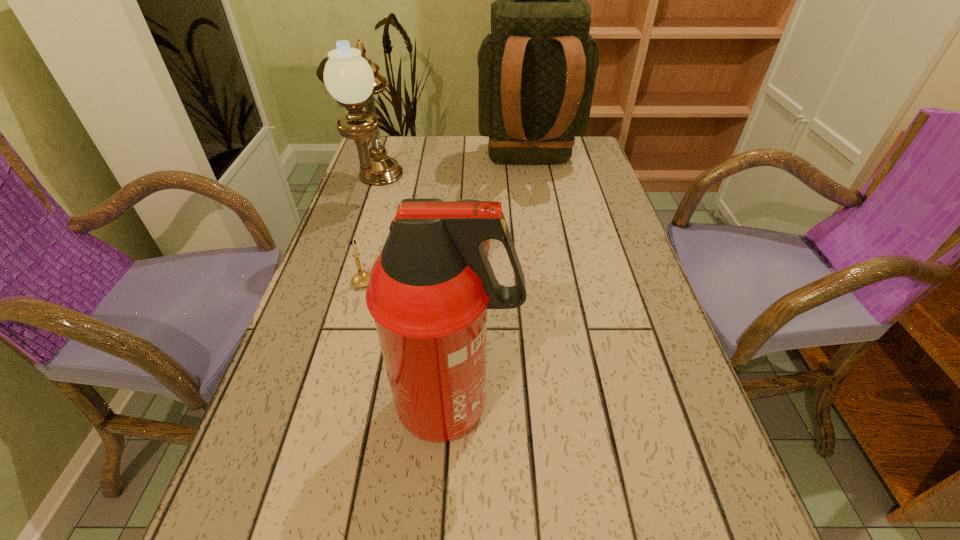
At what (x,y) coordinates should I click in order to perform the action: click on backpack. Please return your answer as a coordinate pair (x, y). The width and height of the screenshot is (960, 540). Looking at the image, I should click on (537, 69).

Where is `oil lamp`? This screenshot has height=540, width=960. oil lamp is located at coordinates (352, 79).

Find the location of `the nearest object`. the nearest object is located at coordinates (430, 287).

Find the location of `the third farthest object`. the third farthest object is located at coordinates (486, 244).

Where is `the second nearest object`? the second nearest object is located at coordinates (361, 279).

At what (x,y) coordinates should I click in order to perform the action: click on vacant region located on the back of the backpack. Please return your answer as a coordinate pair (x, y). This screenshot has width=960, height=540. Looking at the image, I should click on (536, 204).

This screenshot has height=540, width=960. What are the coordinates of `free space located 0.100m on the back of the oil lamp` in the screenshot? It's located at (x=390, y=148).

Find the location of a particular element. The width and height of the screenshot is (960, 540). vacant space located on the trigger side of the fire extinguisher is located at coordinates pos(642,407).

The width and height of the screenshot is (960, 540). What are the coordinates of `vacant space located on the side of the third farthest object with the handle` in the screenshot? It's located at (470, 186).

Where is `free space located on the side of the third farthest object with the handle`? The height and width of the screenshot is (540, 960). free space located on the side of the third farthest object with the handle is located at coordinates (470, 185).